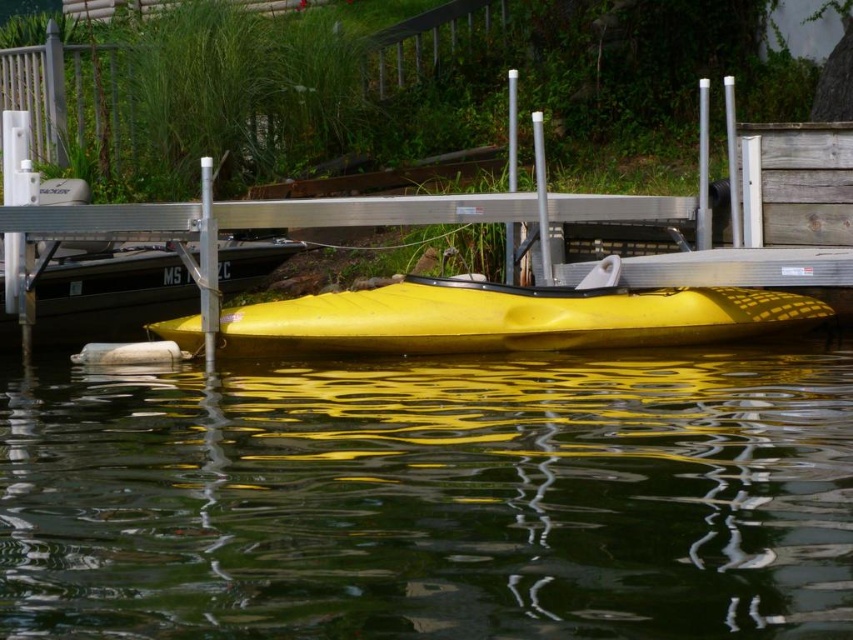
You are planning to rent a kayak for a short trip. You see two kayaks at the lakeside, the glossy yellow kayak at center and the yellow matte kayak at center. Which one is larger?

The yellow matte kayak at center is larger than the glossy yellow kayak at center.

You are a kayaker planning to launch your kayak into the water. You see two kayaks at the center of the image. Which kayak is farther from the water? Please choose between the glossy yellow kayak at center and the yellow matte kayak at center.

The glossy yellow kayak at center is 4.25 meters away from the yellow matte kayak at center. However, both kayaks are at the center of the image, so their distance from the water cannot be determined based on the provided information.